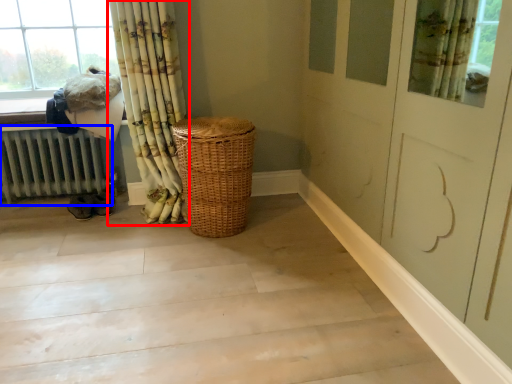
Question: Which object appears farthest to the camera in this image, curtain (highlighted by a red box) or radiator (highlighted by a blue box)?

Choices:
 (A) curtain
 (B) radiator

Answer: (B)